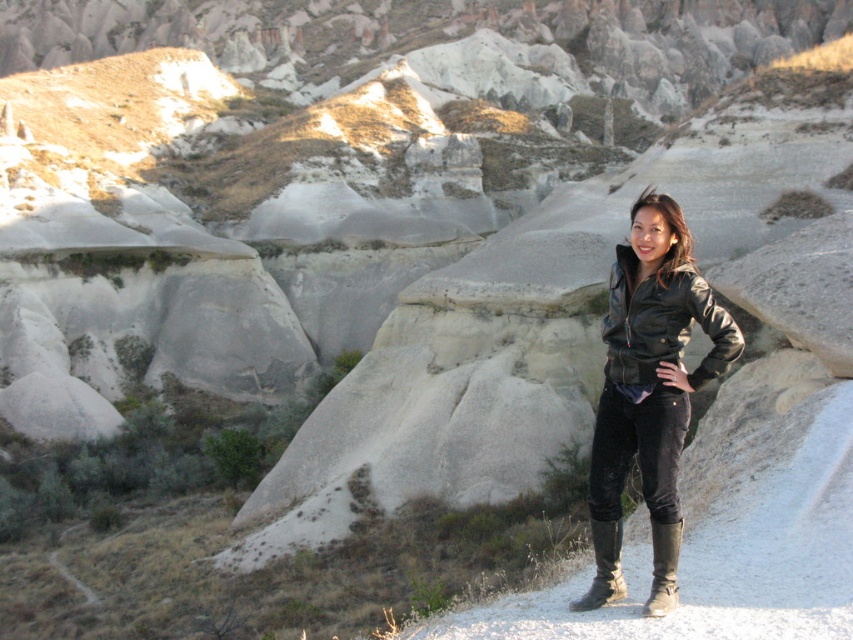
Who is taller, black leather jacket at right or leather jacket at center?

black leather jacket at right

Describe the element at coordinates (648, 392) in the screenshot. I see `black leather jacket at right` at that location.

Where is `black leather jacket at right`? black leather jacket at right is located at coordinates (648, 392).

Does black leather jacket at right appear under brown suede boot at lower right?

No.

Is black leather jacket at right to the right of brown suede boot at lower right from the viewer's perspective?

Correct, you'll find black leather jacket at right to the right of brown suede boot at lower right.

Does point (606, 584) come behind point (643, 611)?

Yes, point (606, 584) is farther from viewer.

Where is `black leather jacket at right`? This screenshot has width=853, height=640. black leather jacket at right is located at coordinates (x=648, y=392).

Is leather jacket at center bigger than black leather boot at lower right?

Correct, leather jacket at center is larger in size than black leather boot at lower right.

Between leather jacket at center and black leather boot at lower right, which one has more height?

With more height is leather jacket at center.

This screenshot has height=640, width=853. I want to click on leather jacket at center, so click(x=662, y=323).